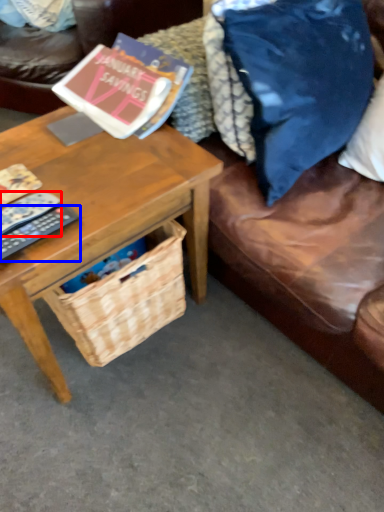
Question: Which object is closer to the camera taking this photo, remote control (highlighted by a red box) or remote control (highlighted by a blue box)?

Choices:
 (A) remote control
 (B) remote control

Answer: (B)